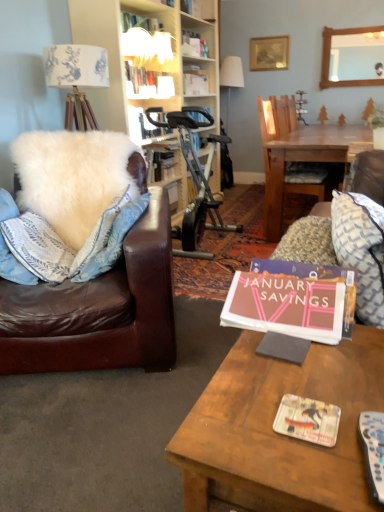
You are a GUI agent. You are given a task and a screenshot of the screen. Output one action in this format:
    pyautogui.click(x=<x>, y=<y>)
    Task: Click on the free location above matte white book at upper center, arranged as the first book when viewed from the top (from a real-world perspective)
    The width and height of the screenshot is (384, 512).
    Given the screenshot: What is the action you would take?
    (148, 64)